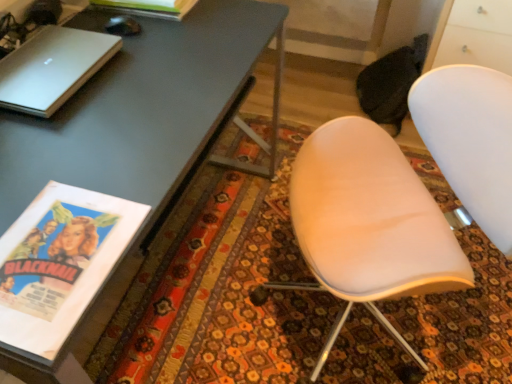
Question: Looking at their shapes, would you say silver metallic laptop at upper left is wider or thinner than matte gray desk at upper left?

Choices:
 (A) thin
 (B) wide

Answer: (A)

Question: Is point (45, 41) positioned closer to the camera than point (6, 147)?

Choices:
 (A) closer
 (B) farther

Answer: (B)

Question: Which is farther from the silver metallic laptop at upper left?

Choices:
 (A) matte paper magazine at upper left
 (B) matte gray desk at upper left
 (C) white matte chair at center
 (D) black glossy mouse at upper left

Answer: (C)

Question: Which object is positioned closest to the white matte chair at center?

Choices:
 (A) silver metallic laptop at upper left
 (B) matte paper magazine at upper left
 (C) black glossy mouse at upper left
 (D) matte gray desk at upper left

Answer: (D)